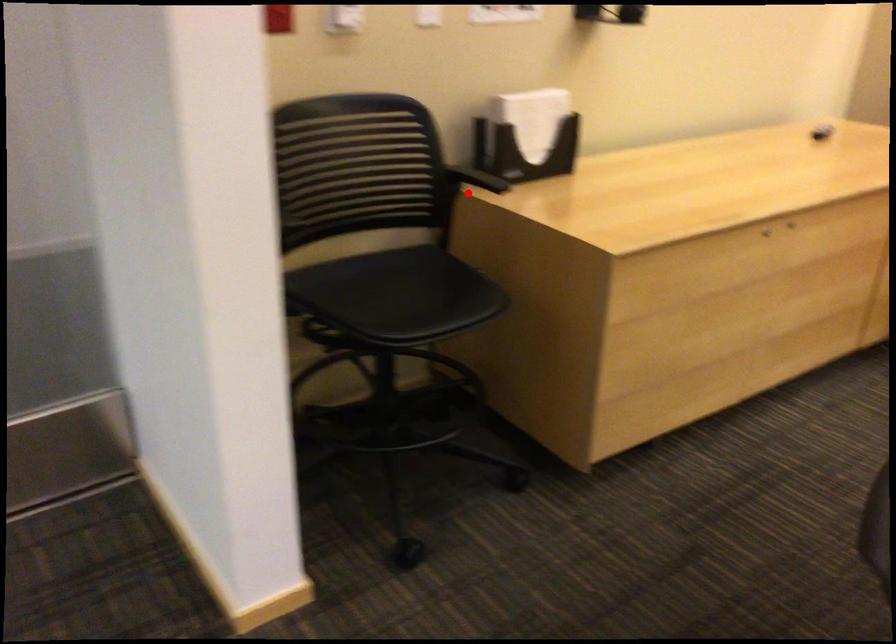
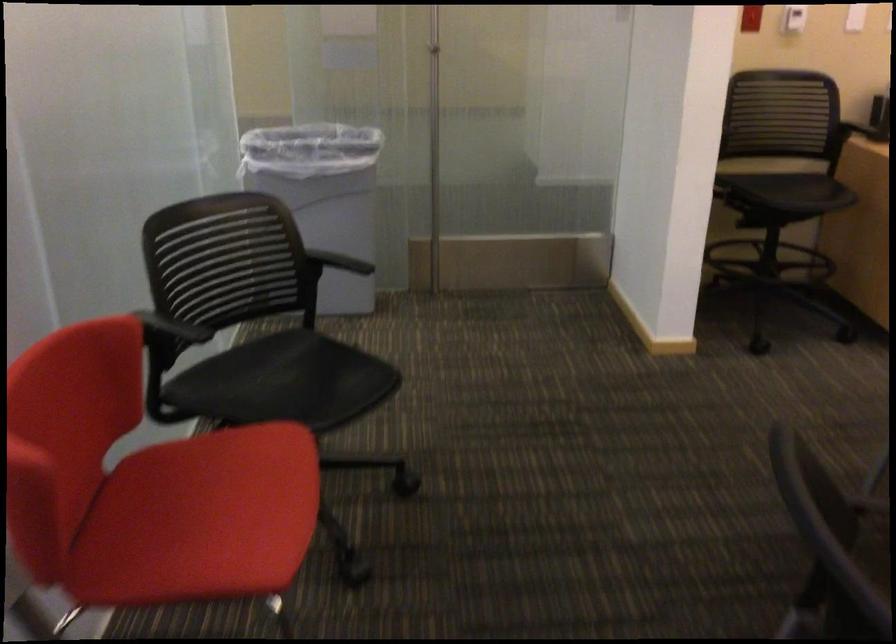
Question: I am providing you with two images of the same scene from different viewpoints. Given a red point in image1, look at the same physical point in image2. Is it:

Choices:
 (A) Closer to the viewpoint
 (B) Farther from the viewpoint

Answer: (B)